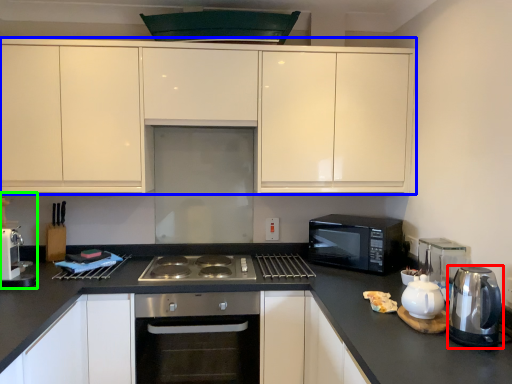
Question: Which is farther away from kitchen appliance (highlighted by a red box)? cabinetry (highlighted by a blue box) or coffee machine (highlighted by a green box)?

Choices:
 (A) cabinetry
 (B) coffee machine

Answer: (B)